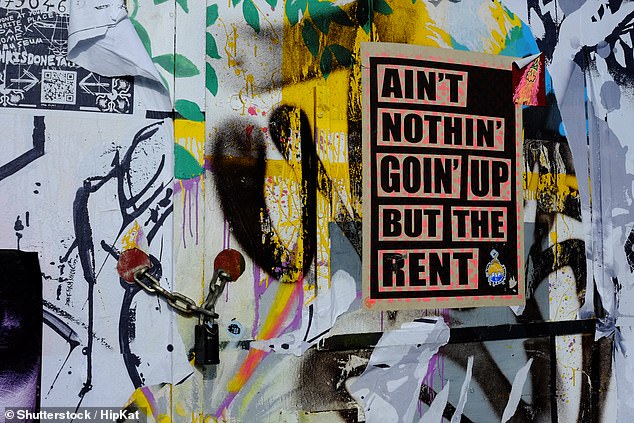
This screenshot has width=634, height=423. I want to click on pink paint, so 190,184, 257,281, 300,310, 432,369.